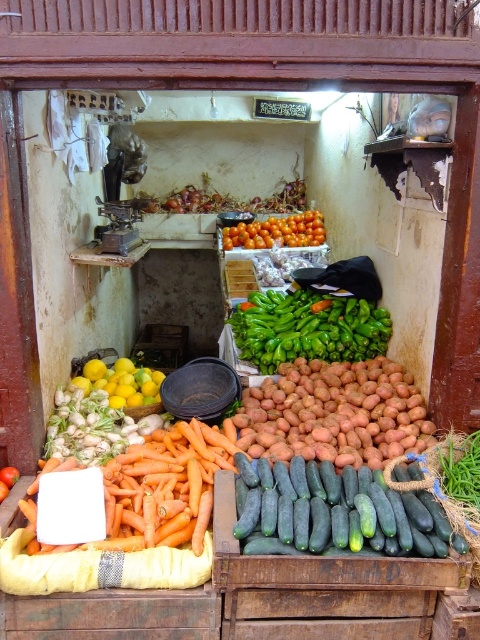
Question: Which point is farther from the camera taking this photo?

Choices:
 (A) (252, 488)
 (B) (109, 396)

Answer: (B)

Question: Is yellow matte lemons at center to the right of orange matte tomatoes at center from the viewer's perspective?

Choices:
 (A) no
 (B) yes

Answer: (A)

Question: In this image, where is green glossy bell peppers at center located relative to yellow matte lemons at center?

Choices:
 (A) left
 (B) right

Answer: (B)

Question: Which of the following is the closest to the observer?

Choices:
 (A) green smooth cucumber at center
 (B) smooth orange potatoes at center
 (C) green glossy bell peppers at center

Answer: (A)

Question: Which of the following is the closest to the observer?

Choices:
 (A) green glossy bell peppers at center
 (B) orange matte carrots at center
 (C) green smooth cucumber at center

Answer: (C)

Question: Can you confirm if yellow matte lemons at center is wider than orange matte tomatoes at center?

Choices:
 (A) no
 (B) yes

Answer: (A)